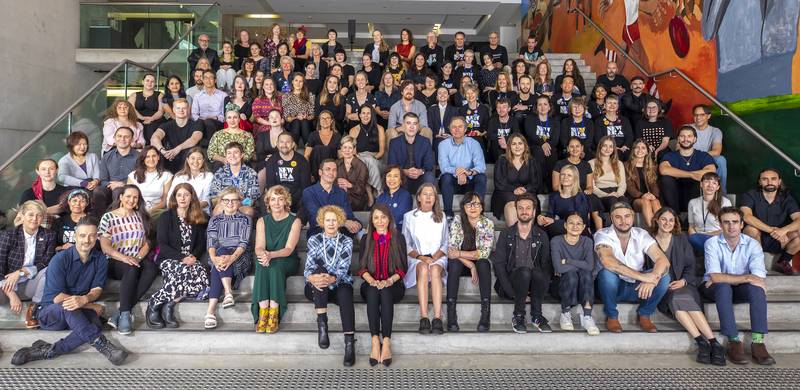
Where is `light`? light is located at coordinates (302, 6), (310, 17), (273, 14), (241, 4), (384, 8), (408, 18), (462, 7), (462, 20), (438, 23), (436, 28).